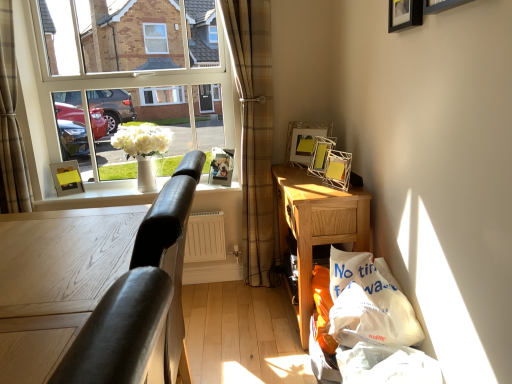
Find the location of `free location in front of brown plaid curtain at left, which appears as the first curtain when viewed from the right`. free location in front of brown plaid curtain at left, which appears as the first curtain when viewed from the right is located at coordinates (251, 303).